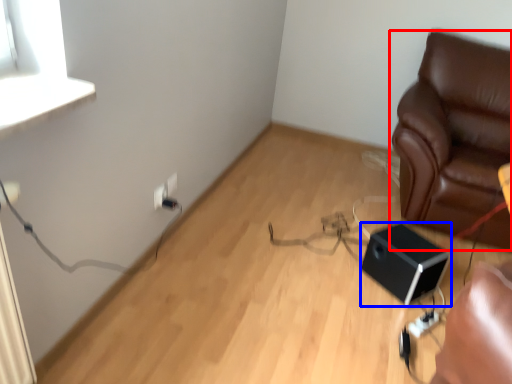
Question: Which of the following is the closest to the observer, furniture (highlighted by a red box) or speaker (highlighted by a blue box)?

Choices:
 (A) furniture
 (B) speaker

Answer: (A)